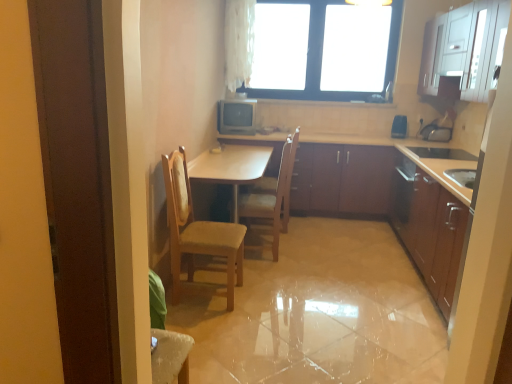
Question: From the image's perspective, would you say blue plastic speaker at upper right, acting as the 1th appliance starting from the right, is shown under wooden chair at center, which is counted as the first chair, starting from the front?

Choices:
 (A) no
 (B) yes

Answer: (A)

Question: Is blue plastic speaker at upper right, arranged as the 2th appliance when viewed from the left, facing away from wooden chair at center, which is counted as the first chair, starting from the front?

Choices:
 (A) no
 (B) yes

Answer: (A)

Question: Considering the relative positions of blue plastic speaker at upper right, arranged as the 2th appliance when viewed from the left, and wooden chair at center, which is counted as the first chair, starting from the front, in the image provided, is blue plastic speaker at upper right, arranged as the 2th appliance when viewed from the left, behind wooden chair at center, which is counted as the first chair, starting from the front,?

Choices:
 (A) no
 (B) yes

Answer: (B)

Question: Is blue plastic speaker at upper right, arranged as the 2th appliance when viewed from the left, closer to camera compared to wooden chair at center, which is counted as the first chair, starting from the front?

Choices:
 (A) no
 (B) yes

Answer: (A)

Question: From a real-world perspective, is blue plastic speaker at upper right, acting as the 1th appliance starting from the right, over wooden chair at center, which is counted as the first chair, starting from the front?

Choices:
 (A) yes
 (B) no

Answer: (A)

Question: In terms of width, does white glossy cabinet at upper right, the 1th cabinetry from the top, look wider or thinner when compared to wooden at center, marked as the 1th chair in a back-to-front arrangement?

Choices:
 (A) wide
 (B) thin

Answer: (B)

Question: From the image's perspective, is white glossy cabinet at upper right, arranged as the fourth cabinetry when ordered from the bottom, located above or below wooden at center, marked as the 1th chair in a back-to-front arrangement?

Choices:
 (A) above
 (B) below

Answer: (A)

Question: From a real-world perspective, is white glossy cabinet at upper right, the 1th cabinetry from the top, above or below wooden at center, marked as the 1th chair in a back-to-front arrangement?

Choices:
 (A) above
 (B) below

Answer: (A)

Question: Relative to wooden at center, marked as the 1th chair in a back-to-front arrangement, is white glossy cabinet at upper right, arranged as the fourth cabinetry when ordered from the bottom, in front or behind?

Choices:
 (A) front
 (B) behind

Answer: (A)

Question: Considering the positions of blue plastic speaker at upper right, arranged as the 2th appliance when viewed from the left, and wooden chair at center, arranged as the second chair when viewed from the back, in the image, is blue plastic speaker at upper right, arranged as the 2th appliance when viewed from the left, wider or thinner than wooden chair at center, arranged as the second chair when viewed from the back,?

Choices:
 (A) thin
 (B) wide

Answer: (A)

Question: Is point (399, 117) closer or farther from the camera than point (173, 299)?

Choices:
 (A) closer
 (B) farther

Answer: (B)

Question: From a real-world perspective, relative to wooden chair at center, arranged as the second chair when viewed from the back, is blue plastic speaker at upper right, arranged as the 2th appliance when viewed from the left, vertically above or below?

Choices:
 (A) below
 (B) above

Answer: (B)

Question: In terms of size, does blue plastic speaker at upper right, acting as the 1th appliance starting from the right, appear bigger or smaller than wooden chair at center, arranged as the second chair when viewed from the back?

Choices:
 (A) small
 (B) big

Answer: (A)

Question: From a real-world perspective, is wooden at center, the 2th chair in the front-to-back sequence, above or below light brown wood table at center?

Choices:
 (A) above
 (B) below

Answer: (A)

Question: Is wooden at center, marked as the 1th chair in a back-to-front arrangement, bigger or smaller than light brown wood table at center?

Choices:
 (A) big
 (B) small

Answer: (B)